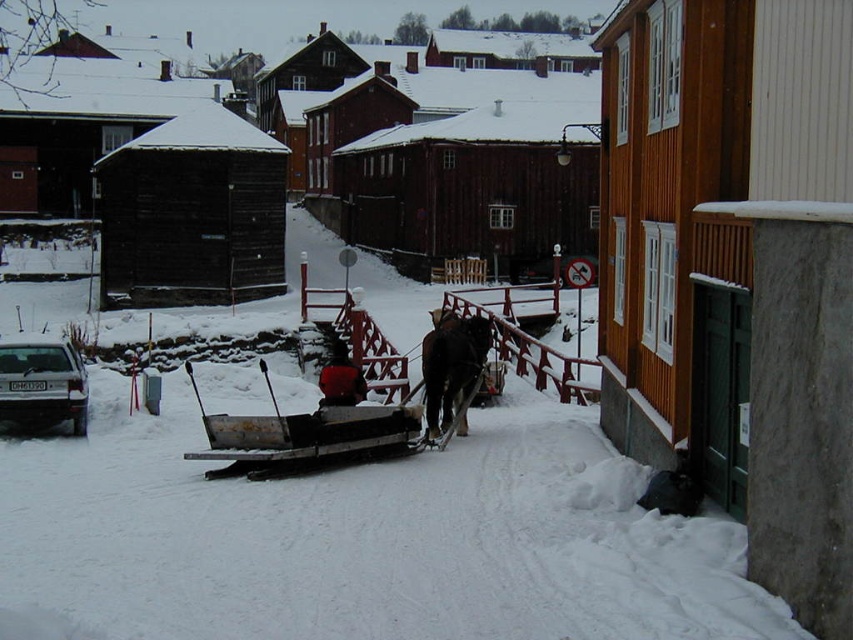
You are standing in the snowy village scene and want to determine which of the two points, point (380, 406) or point (456, 369), is nearer to you. Based on the image, which point is closer?

Point (380, 406) is closer to the viewer than point (456, 369).

You are a traveler standing near the dark brown glossy horse at center and the smooth red sled at center. You want to climb onto the sled. Which object should you approach first based on their heights?

The dark brown glossy horse at center has a lesser height compared to the smooth red sled at center. Therefore, you should approach the dark brown glossy horse at center first since it is shorter and easier to step onto before climbing onto the taller sled.

You are standing at the origin point in the snowy scene. The metallic silver sled at center is located at coordinates 0.678 in the x direction and 0.353 in the y direction. If you want to reach the sled as quickly as possible, which direction should you move in?

To reach the metallic silver sled at center as quickly as possible, you should move in the direction of the coordinates 0.678 in the x direction and 0.353 in the y direction, which is northeast. This path would be the most direct route.